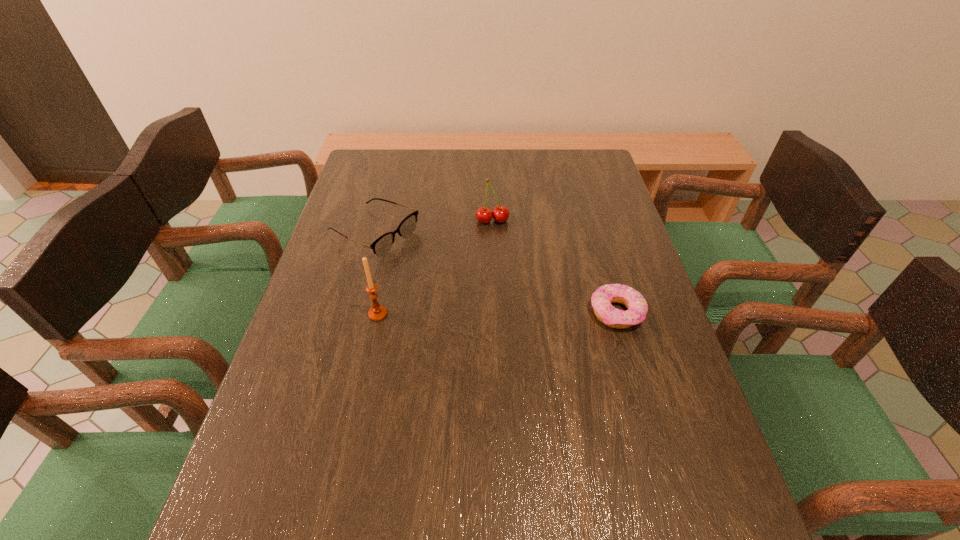
Image resolution: width=960 pixels, height=540 pixels. I want to click on the tallest object, so click(377, 312).

The height and width of the screenshot is (540, 960). What are the coordinates of `doughnut` in the screenshot? It's located at (601, 299).

Find the location of a particular element. This screenshot has height=540, width=960. the shortest object is located at coordinates (601, 299).

Locate an element on the screen. the third object from left to right is located at coordinates (484, 215).

At what (x,y) coordinates should I click in order to perform the action: click on cherry. Please return your answer as a coordinate pair (x, y). This screenshot has width=960, height=540. Looking at the image, I should click on (484, 215).

Where is `the second shortest object`? The height and width of the screenshot is (540, 960). the second shortest object is located at coordinates (381, 246).

The height and width of the screenshot is (540, 960). I want to click on vacant region located 0.400m on the back of the tallest object, so click(x=399, y=212).

The height and width of the screenshot is (540, 960). I want to click on vacant point located 0.350m on the left of the doughnut, so click(449, 313).

This screenshot has height=540, width=960. In order to click on free space located with the stems of the third shortest object pointing upwards in this screenshot , I will do `click(501, 255)`.

Locate an element on the screen. free space located 0.130m with the stems of the third shortest object pointing upwards is located at coordinates (501, 255).